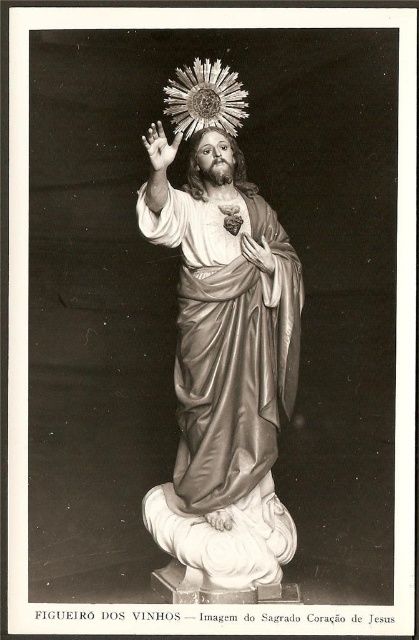
Is point (281, 330) behind point (211, 524)?

Yes, point (281, 330) is farther from viewer.

Image resolution: width=419 pixels, height=640 pixels. In order to click on shiny silver robe at center in this screenshot , I will do `click(227, 348)`.

In the scene shown: Who is lower down, matte gold hand at center or matte gold hand at lower center?

matte gold hand at lower center

Is matte gold hand at center taller than matte gold hand at lower center?

Indeed, matte gold hand at center has a greater height compared to matte gold hand at lower center.

Between point (266, 269) and point (224, 520), which one is positioned in front?

Positioned in front is point (224, 520).

Find the location of a particular element. This screenshot has width=419, height=640. matte gold hand at center is located at coordinates (258, 252).

Can you confirm if shiny silver robe at center is positioned above matte gold hand at center?

No, shiny silver robe at center is not above matte gold hand at center.

Consider the image. Does shiny silver robe at center appear on the left side of matte gold hand at center?

Correct, you'll find shiny silver robe at center to the left of matte gold hand at center.

Is point (294, 310) positioned in front of point (260, 250)?

No, it is behind (260, 250).

Where is `shiny silver robe at center`? The image size is (419, 640). shiny silver robe at center is located at coordinates (227, 348).